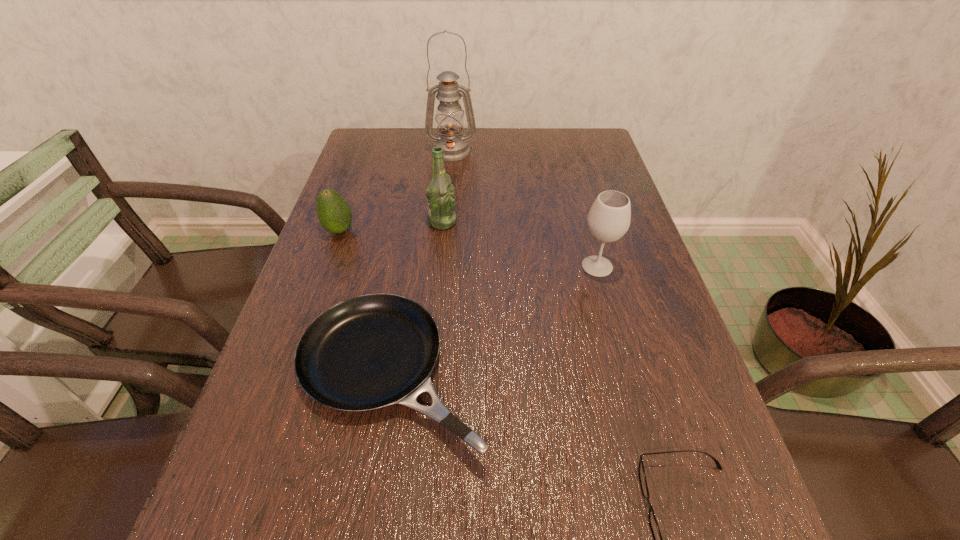
Locate an element on the screen. the tallest object is located at coordinates [449, 117].

What are the coordinates of `oil lamp` in the screenshot? It's located at (449, 117).

Find the location of `beer bottle`. beer bottle is located at coordinates (440, 196).

Where is `the third nearest object`? the third nearest object is located at coordinates (609, 218).

This screenshot has height=540, width=960. What are the coordinates of `the third shortest object` in the screenshot? It's located at (334, 214).

This screenshot has height=540, width=960. I want to click on the fifth tallest object, so tap(368, 352).

Locate an element on the screen. The width and height of the screenshot is (960, 540). free location located on the left of the farthest object is located at coordinates (385, 152).

Where is `free space located 0.180m on the surface of the beer bottle`? free space located 0.180m on the surface of the beer bottle is located at coordinates (529, 222).

I want to click on vacant region located on the back of the third nearest object, so click(x=574, y=180).

You are a GUI agent. You are given a task and a screenshot of the screen. Output one action in this format:
    pyautogui.click(x=<x>, y=<y>)
    Task: Click on the vacant space located on the front of the avocado
    
    Given the screenshot: What is the action you would take?
    pyautogui.click(x=320, y=287)